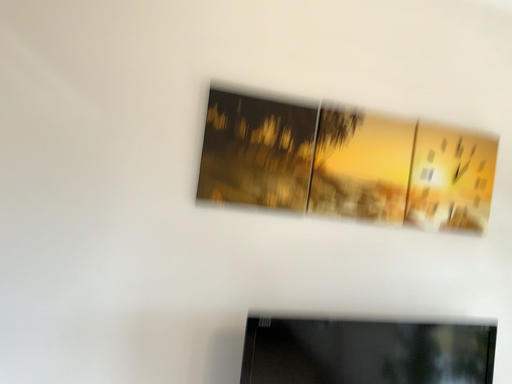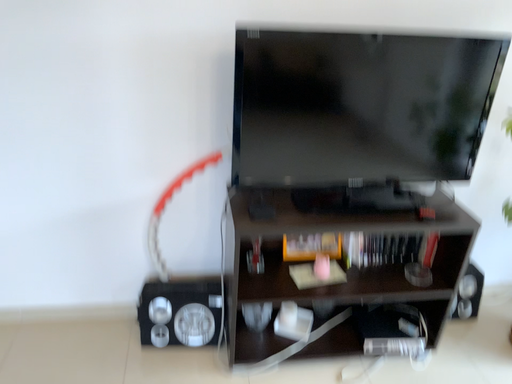
Question: Which way did the camera rotate in the video?

Choices:
 (A) rotated left
 (B) rotated right

Answer: (A)